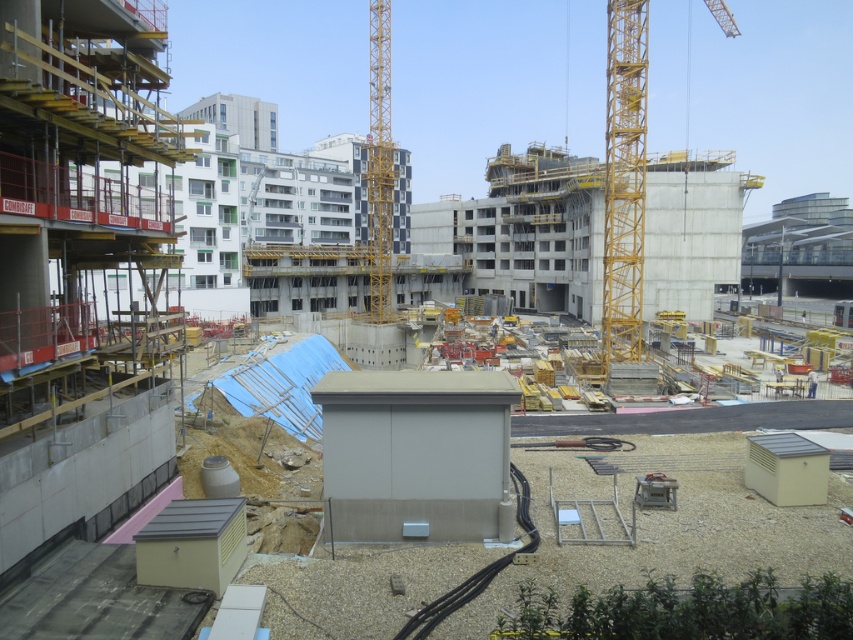
Does yellow metallic crane at upper right appear on the right side of metallic gray generator at lower right?

Yes, yellow metallic crane at upper right is to the right of metallic gray generator at lower right.

Find the location of a particular element. yellow metallic crane at upper right is located at coordinates (624, 180).

Locate an element on the screen. yellow metallic crane at upper right is located at coordinates point(624,180).

Is concrete wall at left to the right of yellow metallic crane at center from the viewer's perspective?

Yes, concrete wall at left is to the right of yellow metallic crane at center.

Can you confirm if concrete wall at left is positioned to the left of yellow metallic crane at center?

In fact, concrete wall at left is to the right of yellow metallic crane at center.

At what (x,y) coordinates should I click in order to perform the action: click on concrete wall at left. Please return your answer as a coordinate pair (x, y). The image size is (853, 640). Looking at the image, I should click on (93, 600).

Between concrete wall at left and yellow metallic crane at upper right, which one appears on the right side from the viewer's perspective?

Positioned to the right is yellow metallic crane at upper right.

I want to click on concrete wall at left, so click(93, 600).

What do you see at coordinates (93, 600) in the screenshot?
I see `concrete wall at left` at bounding box center [93, 600].

In order to click on concrete wall at left in this screenshot , I will do `click(93, 600)`.